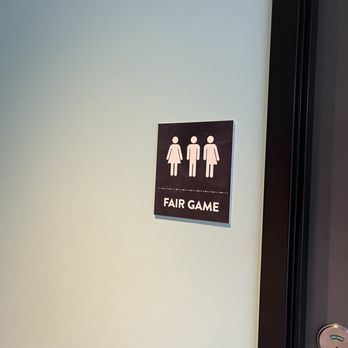
You are a GUI agent. You are given a task and a screenshot of the screen. Output one action in this format:
    pyautogui.click(x=<x>, y=<y>)
    Task: Click on the door
    The width and height of the screenshot is (348, 348).
    Given the screenshot: What is the action you would take?
    pyautogui.click(x=337, y=218)